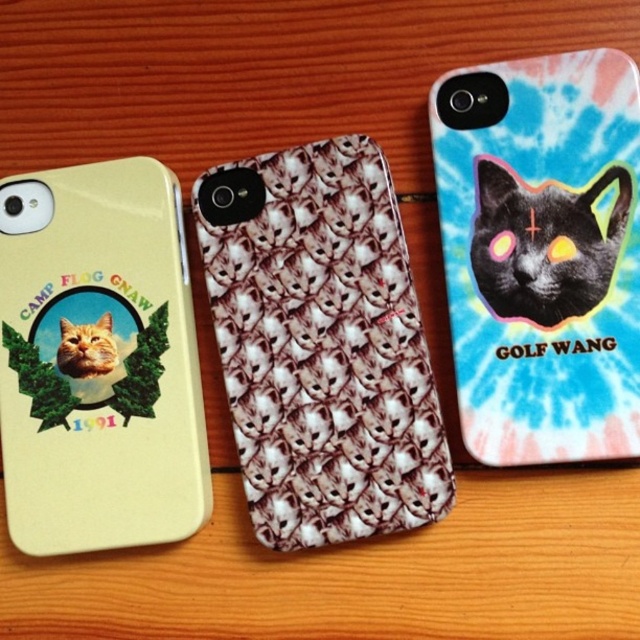
Question: Can you confirm if white textured cats at center is thinner than black glossy cat at center?

Choices:
 (A) no
 (B) yes

Answer: (A)

Question: Is tie-dye plastic cat at center to the right of matte yellow phone case at left from the viewer's perspective?

Choices:
 (A) yes
 (B) no

Answer: (A)

Question: Among these objects, which one is nearest to the camera?

Choices:
 (A) matte yellow phone case at left
 (B) white textured cats at center

Answer: (A)

Question: Among these points, which one is farthest from the camera?

Choices:
 (A) (316, 518)
 (B) (602, 115)

Answer: (A)

Question: Which point is closer to the camera?

Choices:
 (A) (104, 232)
 (B) (532, 216)

Answer: (B)

Question: Is tie-dye plastic cat at center thinner than matte yellow phone case at left?

Choices:
 (A) yes
 (B) no

Answer: (A)